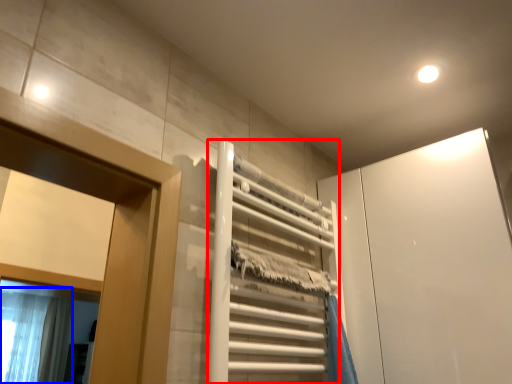
Question: Which of the following is the farthest to the observer, elevator (highlighted by a red box) or shower curtain (highlighted by a blue box)?

Choices:
 (A) elevator
 (B) shower curtain

Answer: (B)